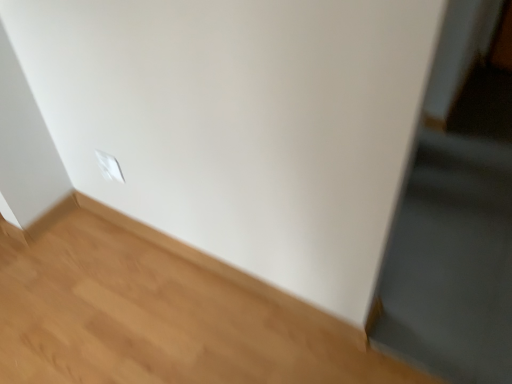
The width and height of the screenshot is (512, 384). Describe the element at coordinates (109, 166) in the screenshot. I see `white plastic electric outlet at lower left` at that location.

Image resolution: width=512 pixels, height=384 pixels. I want to click on white plastic electric outlet at lower left, so click(109, 166).

Locate an element on the screen. white plastic electric outlet at lower left is located at coordinates (109, 166).